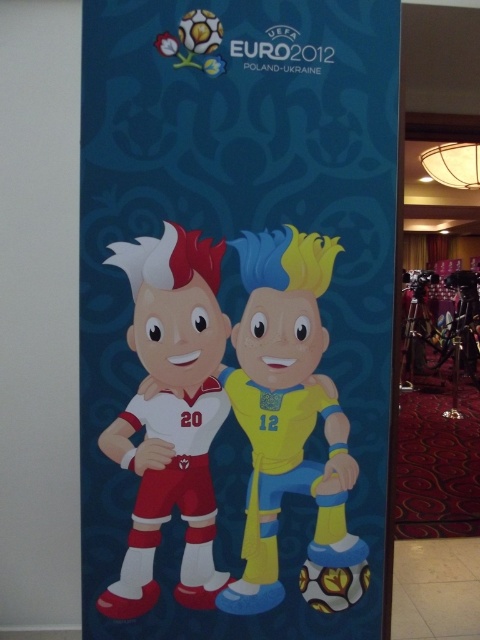
Question: Which point is closer to the camera?

Choices:
 (A) (260, 541)
 (B) (283, 266)

Answer: (B)

Question: Is glossy paper poster at center smaller than matte white jersey at center?

Choices:
 (A) yes
 (B) no

Answer: (B)

Question: Which point is closer to the camera?

Choices:
 (A) (328, 557)
 (B) (223, 577)

Answer: (B)

Question: Is yellow matte soccer ball at center above matte white jersey at center?

Choices:
 (A) yes
 (B) no

Answer: (B)

Question: Which point is farther to the camera?

Choices:
 (A) (300, 390)
 (B) (140, 339)

Answer: (A)

Question: Does glossy paper poster at center appear on the right side of matte white jersey at center?

Choices:
 (A) yes
 (B) no

Answer: (A)